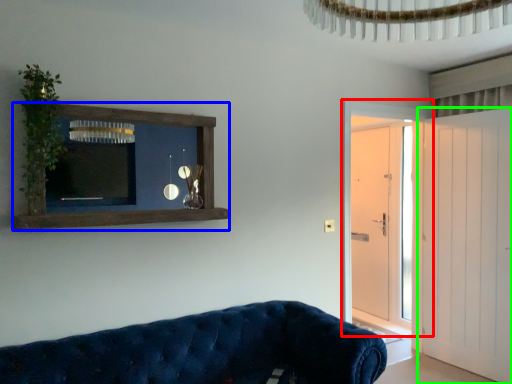
Question: Considering the real-world distances, which object is farthest from door (highlighted by a red box)? shelf (highlighted by a blue box) or door (highlighted by a green box)?

Choices:
 (A) shelf
 (B) door

Answer: (A)